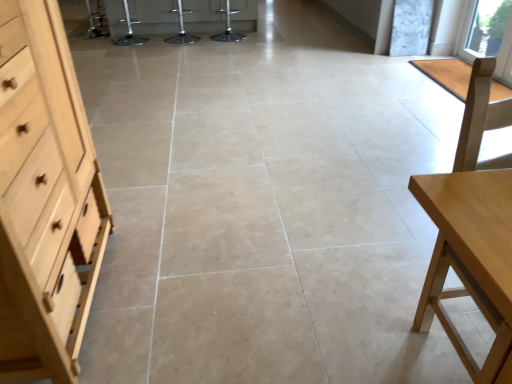
Question: Is metallic silver bar stool at center, the 1th bar stool positioned from the right, taller than transparent glass window at upper right?

Choices:
 (A) yes
 (B) no

Answer: (B)

Question: Considering the relative sizes of metallic silver bar stool at center, which is the third bar stool from left to right, and transparent glass window at upper right in the image provided, is metallic silver bar stool at center, which is the third bar stool from left to right, wider than transparent glass window at upper right?

Choices:
 (A) no
 (B) yes

Answer: (B)

Question: Is metallic silver bar stool at center, which is the third bar stool from left to right, further to the viewer compared to transparent glass window at upper right?

Choices:
 (A) yes
 (B) no

Answer: (A)

Question: Does metallic silver bar stool at center, the 1th bar stool positioned from the right, have a lesser height compared to transparent glass window at upper right?

Choices:
 (A) yes
 (B) no

Answer: (A)

Question: In terms of height, does metallic silver bar stool at center, which appears as the 1th bar stool when viewed from the left, look taller or shorter compared to transparent glass window at upper right?

Choices:
 (A) tall
 (B) short

Answer: (B)

Question: From the image's perspective, is metallic silver bar stool at center, positioned as the third bar stool in right-to-left order, positioned above or below transparent glass window at upper right?

Choices:
 (A) above
 (B) below

Answer: (A)

Question: From a real-world perspective, is metallic silver bar stool at center, which appears as the 1th bar stool when viewed from the left, physically located above or below transparent glass window at upper right?

Choices:
 (A) below
 (B) above

Answer: (A)

Question: In terms of width, does metallic silver bar stool at center, which appears as the 1th bar stool when viewed from the left, look wider or thinner when compared to transparent glass window at upper right?

Choices:
 (A) thin
 (B) wide

Answer: (B)

Question: Is transparent glass window at upper right taller or shorter than metallic silver bar stool at center, positioned as the third bar stool in right-to-left order?

Choices:
 (A) tall
 (B) short

Answer: (A)

Question: In terms of size, does transparent glass window at upper right appear bigger or smaller than metallic silver bar stool at center, which appears as the 1th bar stool when viewed from the left?

Choices:
 (A) big
 (B) small

Answer: (B)

Question: In terms of width, does transparent glass window at upper right look wider or thinner when compared to metallic silver bar stool at center, which appears as the 1th bar stool when viewed from the left?

Choices:
 (A) wide
 (B) thin

Answer: (B)

Question: Does point [x=510, y=71] appear closer or farther from the camera than point [x=128, y=38]?

Choices:
 (A) farther
 (B) closer

Answer: (B)

Question: Is light wood dresser at left inside or outside of light wood table at right?

Choices:
 (A) outside
 (B) inside

Answer: (A)

Question: In terms of size, does light wood dresser at left appear bigger or smaller than light wood table at right?

Choices:
 (A) big
 (B) small

Answer: (A)